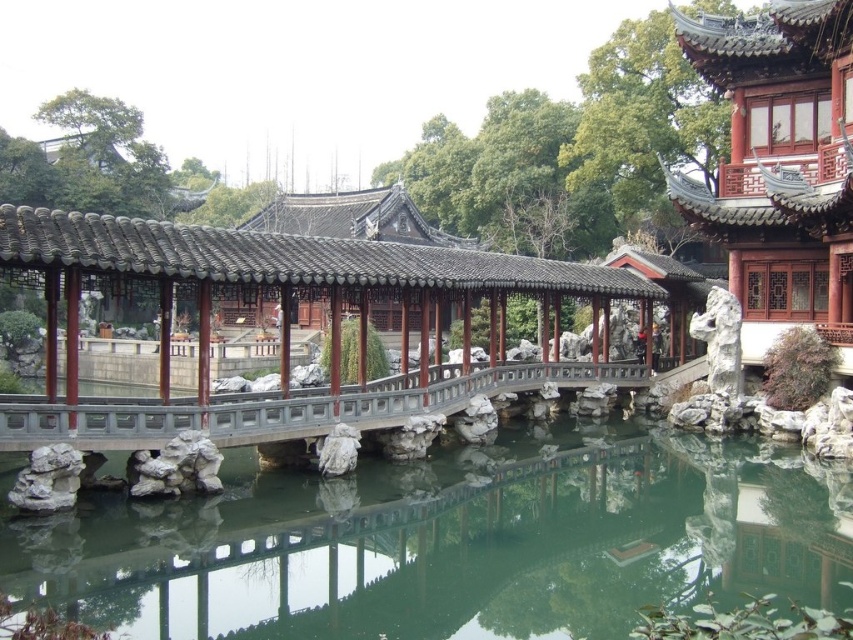
This screenshot has height=640, width=853. I want to click on wooden bridge at center, so click(289, 324).

Consider the image. Who is positioned more to the right, wooden bridge at center or smooth gray stone bridge at center?

smooth gray stone bridge at center

This screenshot has height=640, width=853. In order to click on wooden bridge at center in this screenshot , I will do `click(289, 324)`.

At what (x,y) coordinates should I click in order to perform the action: click on clear glass water at center. Please return your answer as a coordinate pair (x, y). Looking at the image, I should click on (454, 541).

What do you see at coordinates (454, 541) in the screenshot?
I see `clear glass water at center` at bounding box center [454, 541].

Does point (584, 513) come closer to viewer compared to point (486, 285)?

Yes, it is.

Find the location of a particular element. The height and width of the screenshot is (640, 853). clear glass water at center is located at coordinates (454, 541).

Does clear glass water at center have a greater height compared to smooth gray stone bridge at center?

Correct, clear glass water at center is much taller as smooth gray stone bridge at center.

Locate an element on the screen. The image size is (853, 640). clear glass water at center is located at coordinates (454, 541).